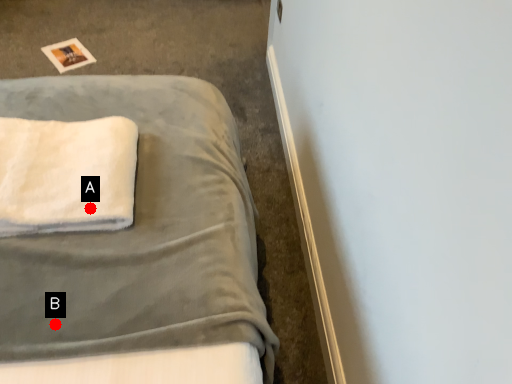
Question: Two points are circled on the image, labeled by A and B beside each circle. Among these points, which one is nearest to the camera?

Choices:
 (A) A is closer
 (B) B is closer

Answer: (B)